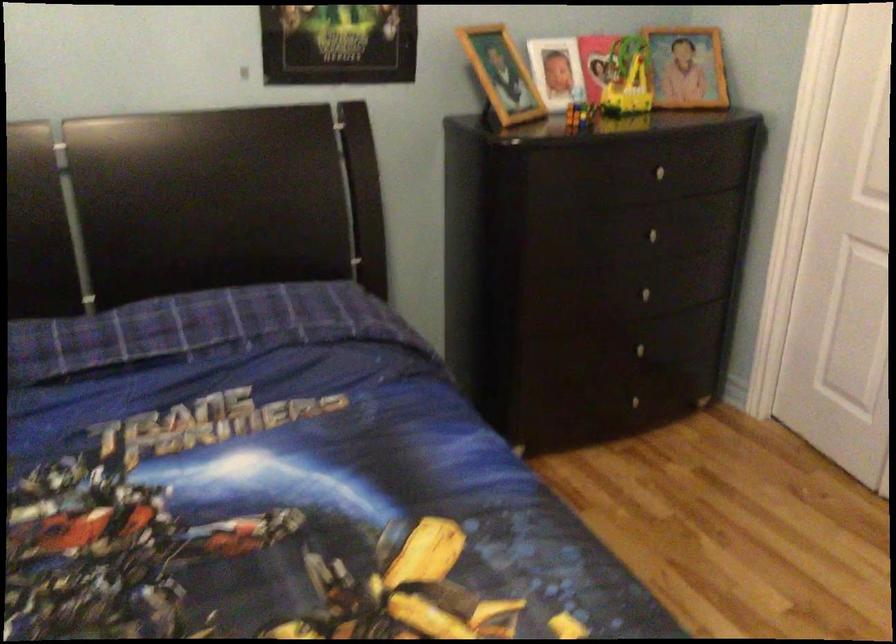
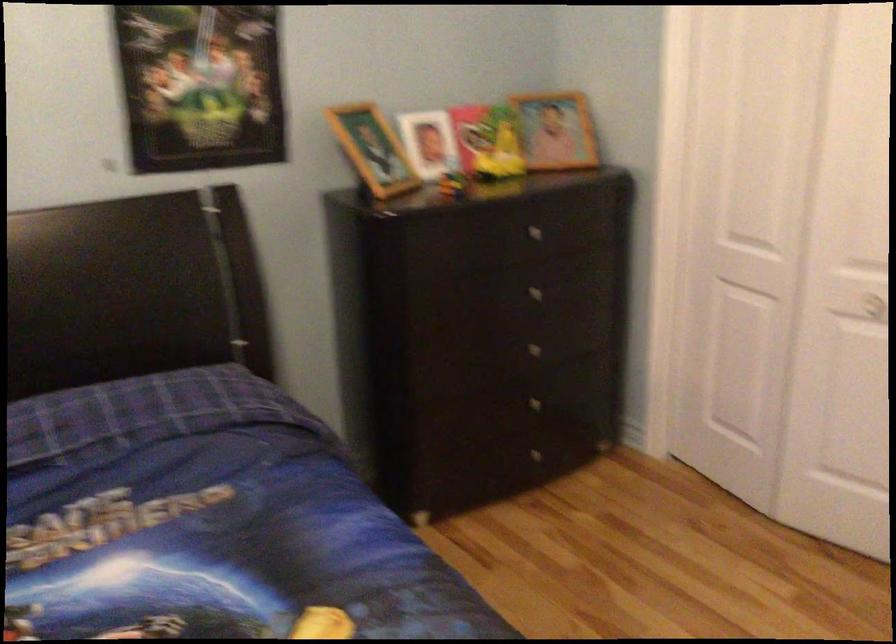
In the second image, find the point that corresponds to [618,77] in the first image.

(487, 142)